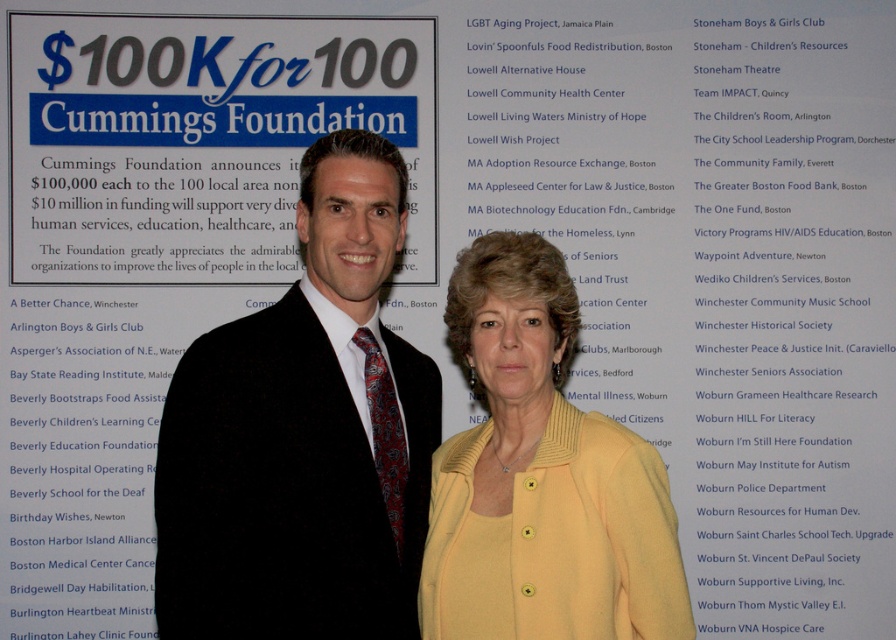
Is black velvet suit at center thinner than yellow matte cardigan at center?

In fact, black velvet suit at center might be wider than yellow matte cardigan at center.

Who is more forward, (197, 413) or (503, 465)?

Point (197, 413)

Where is `black velvet suit at center`? The height and width of the screenshot is (640, 896). black velvet suit at center is located at coordinates (303, 435).

Find the location of a particular element. black velvet suit at center is located at coordinates (303, 435).